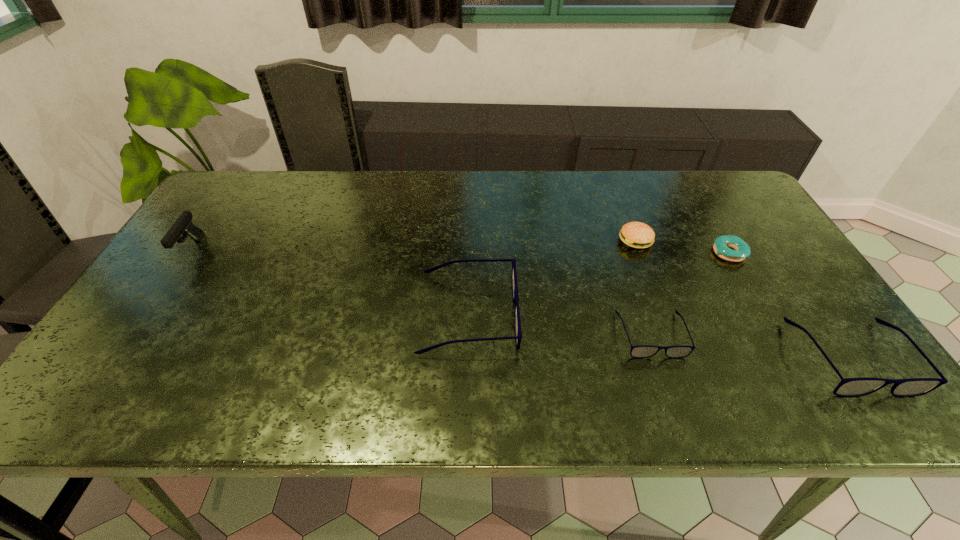
At what (x,y) coordinates should I click in order to perform the action: click on free area in between the rightmost spectacles and the leftmost object. Please return your answer as a coordinate pair (x, y). This screenshot has width=960, height=540. Looking at the image, I should click on (521, 303).

This screenshot has height=540, width=960. What are the coordinates of `unoccupied area between the second spectacles from right to left and the second shortest spectacles` in the screenshot? It's located at (751, 346).

The width and height of the screenshot is (960, 540). I want to click on free spot between the doughnut and the leftmost object, so click(x=460, y=251).

In order to click on empty space that is in between the leftmost object and the shortest object in this screenshot , I will do `click(460, 251)`.

Image resolution: width=960 pixels, height=540 pixels. I want to click on empty space between the pistol and the shortest object, so click(460, 251).

Where is `empty location between the patty and the pistol`? Image resolution: width=960 pixels, height=540 pixels. empty location between the patty and the pistol is located at coordinates coord(414,245).

In order to click on empty space between the pistol and the shortest spectacles in this screenshot , I will do `click(421, 292)`.

Locate an element on the screen. Image resolution: width=960 pixels, height=540 pixels. blank region between the shortest spectacles and the leftmost object is located at coordinates (421, 292).

This screenshot has height=540, width=960. What are the coordinates of `vacant region between the pistol and the second shortest spectacles` in the screenshot? It's located at (521, 303).

Find the location of `the fifth closest object to the leftmost spectacles`. the fifth closest object to the leftmost spectacles is located at coordinates pos(183,225).